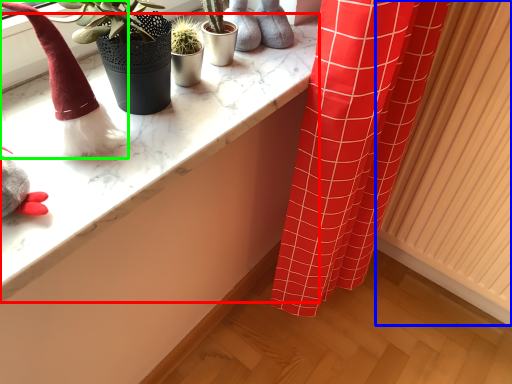
Question: Which object is the closest to the counter top (highlighted by a red box)? Choose among these: radiator (highlighted by a blue box) or toy (highlighted by a green box).

Choices:
 (A) radiator
 (B) toy

Answer: (B)